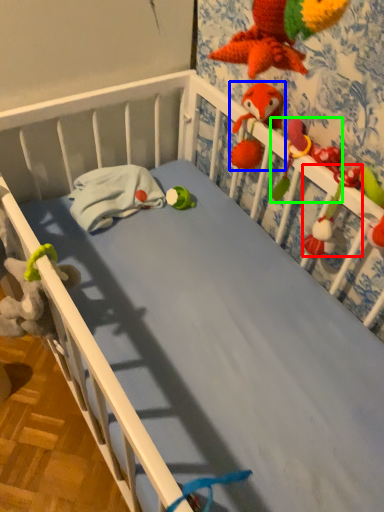
Question: Based on their relative distances, which object is farther from toy (highlighted by a red box)? Choose from toy (highlighted by a blue box) and parrot (highlighted by a green box).

Choices:
 (A) toy
 (B) parrot

Answer: (A)